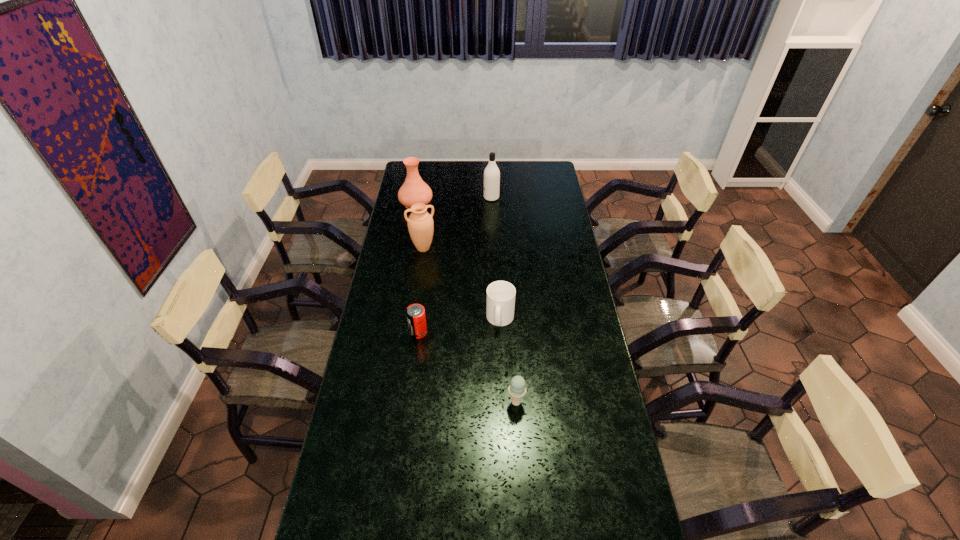
In the image, there is a desktop. Where is `vacant space at the far right corner`? The image size is (960, 540). vacant space at the far right corner is located at coordinates pos(547,165).

Image resolution: width=960 pixels, height=540 pixels. What are the coordinates of `free space between the vase and the can` in the screenshot? It's located at (418, 268).

Where is `free space between the vase and the mug`? Image resolution: width=960 pixels, height=540 pixels. free space between the vase and the mug is located at coordinates (458, 261).

Image resolution: width=960 pixels, height=540 pixels. What are the coordinates of `empty space between the shampoo and the vase` in the screenshot? It's located at click(x=454, y=200).

Find the location of a particular element. vacant space in between the mug and the urn is located at coordinates (462, 284).

Locate an element on the screen. Image resolution: width=960 pixels, height=540 pixels. vacant space that's between the mug and the shampoo is located at coordinates (495, 259).

Where is `free space between the nearest object and the urn`? This screenshot has width=960, height=540. free space between the nearest object and the urn is located at coordinates (469, 325).

You are a GUI agent. You are given a task and a screenshot of the screen. Output one action in this format:
    pyautogui.click(x=<x>, y=<y>)
    Task: Click on the vacant space that's between the nearest object and the urn
    This screenshot has width=960, height=540.
    Given the screenshot: What is the action you would take?
    pyautogui.click(x=469, y=325)

At what (x,y) coordinates should I click in order to perform the action: click on free space between the shampoo and the vase. Please return your answer as a coordinate pair (x, y). Looking at the image, I should click on (454, 200).

The width and height of the screenshot is (960, 540). What are the coordinates of `free space between the can and the vase` in the screenshot? It's located at (418, 268).